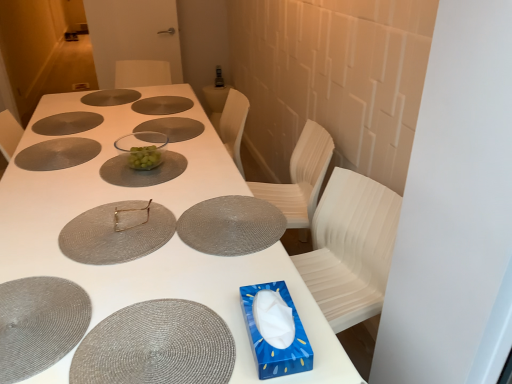
Where is `vacant space to the right of woven gray placemat at lower left`? The width and height of the screenshot is (512, 384). vacant space to the right of woven gray placemat at lower left is located at coordinates tap(143, 278).